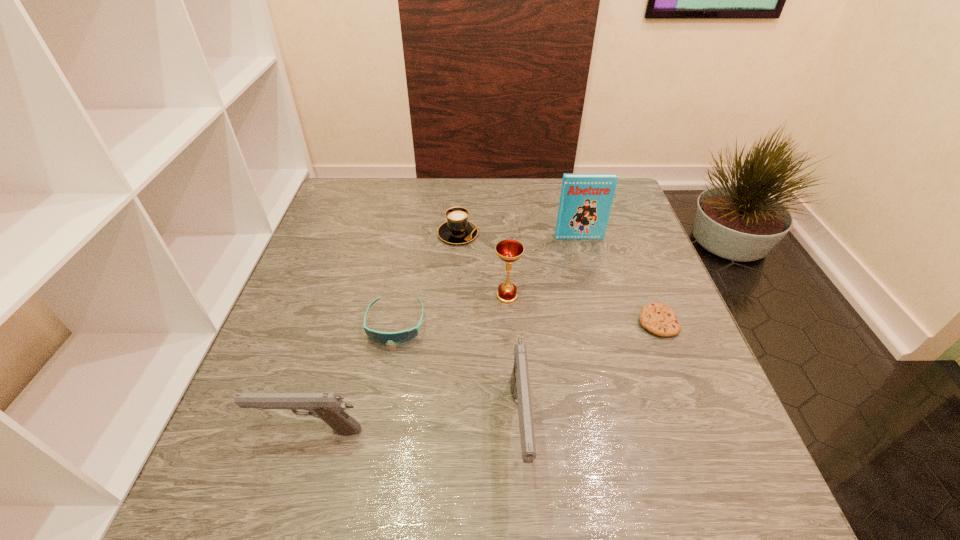
Image resolution: width=960 pixels, height=540 pixels. Identify the location of the tallest object. (585, 204).

In order to click on free space located on the right of the fifth tallest object in this screenshot , I will do `click(509, 234)`.

Find the location of `vacant space situated 0.190m on the front of the shortest object`. vacant space situated 0.190m on the front of the shortest object is located at coordinates (696, 420).

Where is `vacant space located 0.070m on the front-facing side of the sunglasses`? vacant space located 0.070m on the front-facing side of the sunglasses is located at coordinates (386, 376).

The width and height of the screenshot is (960, 540). I want to click on vacant space located 0.300m on the front of the chalice, so click(516, 426).

Identify the location of vacant area located on the front cover of the book. This screenshot has height=540, width=960. (599, 310).

Where is `object that is at the far edge`? The width and height of the screenshot is (960, 540). object that is at the far edge is located at coordinates (457, 229).

The width and height of the screenshot is (960, 540). I want to click on object that is positioned at the left edge, so pos(329,407).

The width and height of the screenshot is (960, 540). Find the location of `cookie situated at the right edge`. cookie situated at the right edge is located at coordinates (658, 318).

You are a GUI agent. You are given a task and a screenshot of the screen. Output one action in this format:
    pyautogui.click(x=<x>, y=<y>)
    Task: Click on the book present at the right edge
    The height and width of the screenshot is (540, 960).
    Given the screenshot: What is the action you would take?
    pyautogui.click(x=585, y=204)